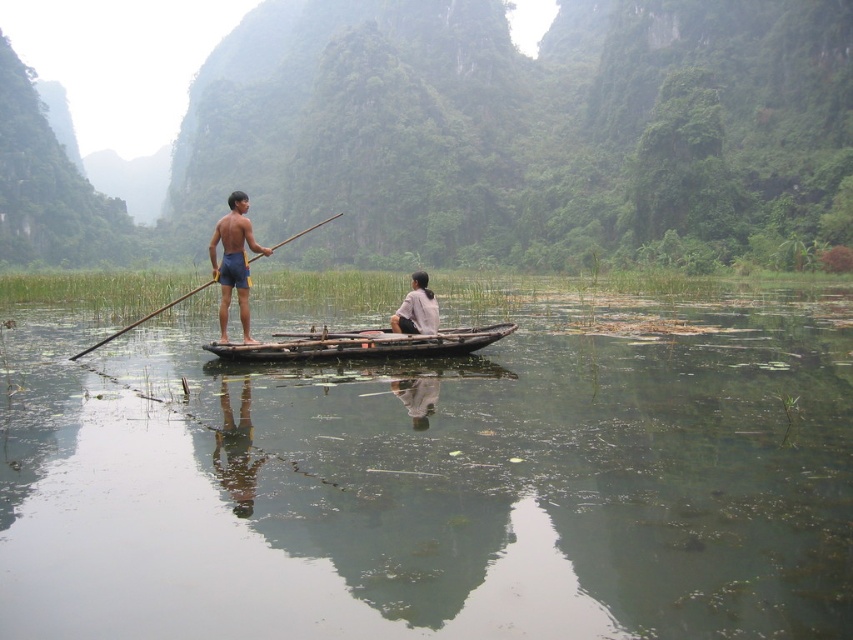
Is the position of wooden canoe at center less distant than that of matte blue shorts at center?

Yes, wooden canoe at center is in front of matte blue shorts at center.

Which is in front, point (514, 330) or point (244, 253)?

Point (244, 253) is in front.

Does point (386, 356) come behind point (227, 236)?

Yes, point (386, 356) is farther from viewer.

Find the location of a particular element. Image resolution: width=853 pixels, height=640 pixels. wooden canoe at center is located at coordinates coord(361,344).

Is matte blue shorts at center wider than white matte shirt at center?

Yes.

Is matte blue shorts at center smaller than white matte shirt at center?

Actually, matte blue shorts at center might be larger than white matte shirt at center.

Between point (221, 232) and point (409, 307), which one is positioned in front?

Point (221, 232) is more forward.

The width and height of the screenshot is (853, 640). Find the location of `matte blue shorts at center`. matte blue shorts at center is located at coordinates (233, 260).

Describe the element at coordinates (361, 344) in the screenshot. I see `wooden canoe at center` at that location.

Does wooden canoe at center have a smaller size compared to brown wood paddle at center?

Yes.

Identify the location of wooden canoe at center. (361, 344).

Where is `wooden canoe at center`? The width and height of the screenshot is (853, 640). wooden canoe at center is located at coordinates (361, 344).